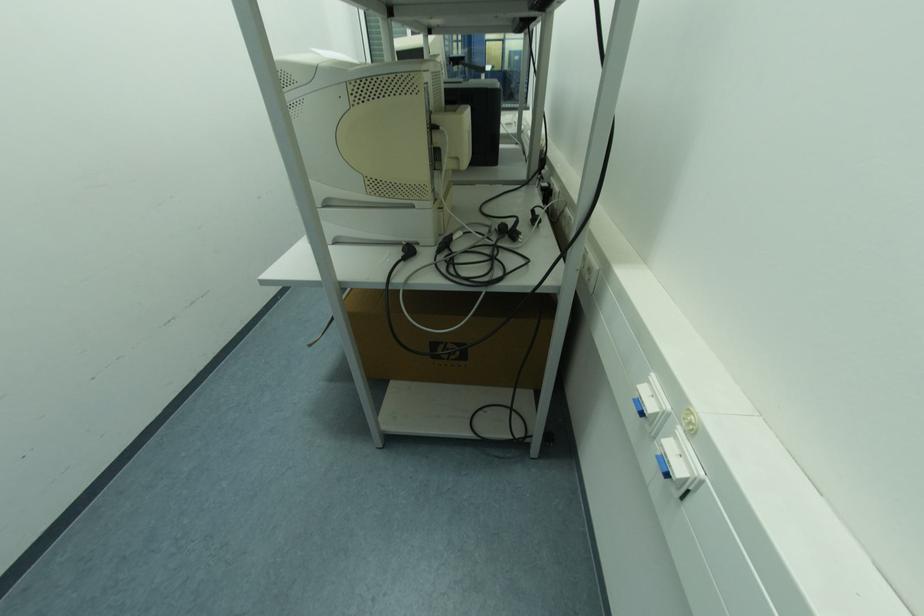
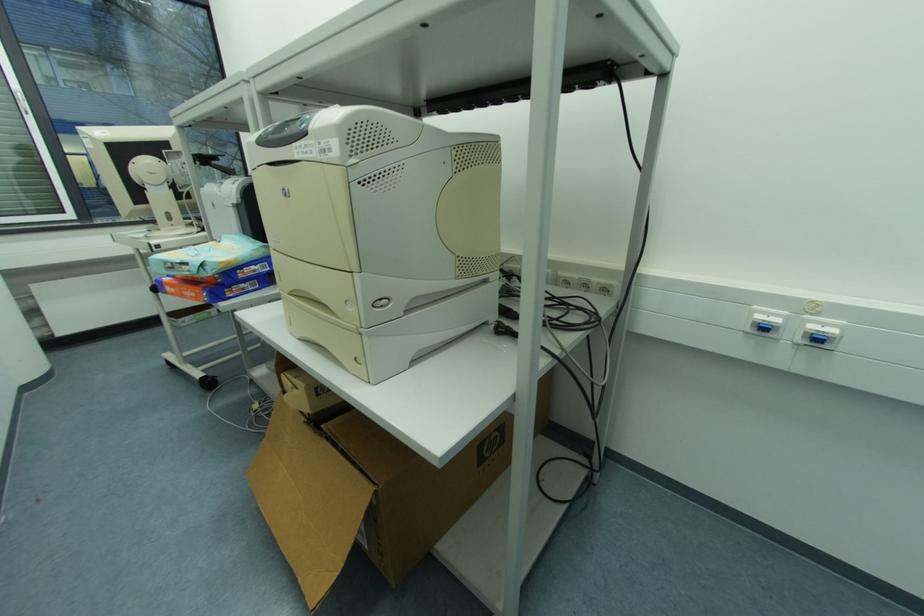
Question: The camera is either moving clockwise (left) or counter-clockwise (right) around the object. The first image is from the beginning of the video and the second image is from the end. Is the camera moving left or right when shooting the video?

Choices:
 (A) Left
 (B) Right

Answer: (A)